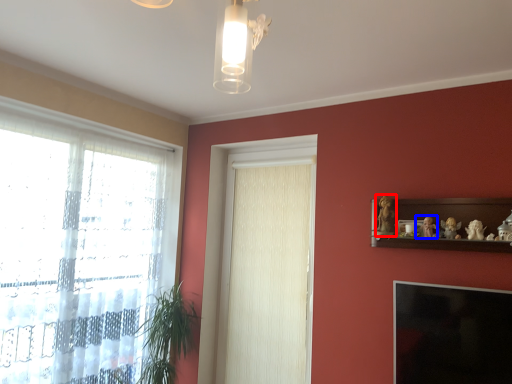
Question: Which object is further to the camera taking this photo, toy (highlighted by a red box) or toy (highlighted by a blue box)?

Choices:
 (A) toy
 (B) toy

Answer: (A)